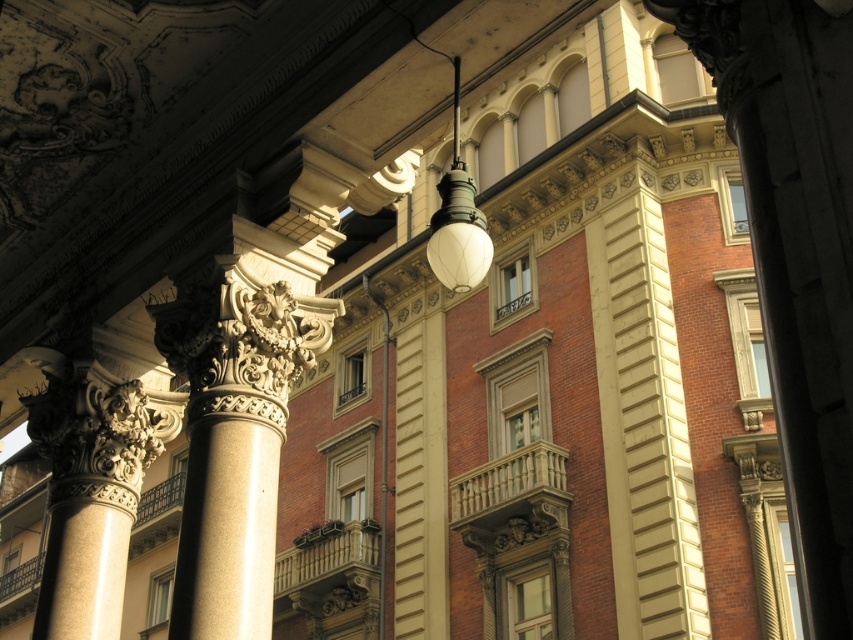
Question: Which point is closer to the camera?

Choices:
 (A) wooden balustrade at center
 (B) dark brown wrought iron at lower left

Answer: (B)

Question: Where is white glass lamp at center located in relation to white marble balustrade at center in the image?

Choices:
 (A) above
 (B) below

Answer: (A)

Question: Which object appears farthest from the camera in this image?

Choices:
 (A) white glass lamp at center
 (B) wooden balustrade at center
 (C) white marble balustrade at center
 (D) dark brown wrought iron at lower left

Answer: (B)

Question: Among these points, which one is nearest to the camera?

Choices:
 (A) (468, 193)
 (B) (154, 486)

Answer: (A)

Question: Does white marble balustrade at center have a greater width compared to dark brown wrought iron at lower left?

Choices:
 (A) no
 (B) yes

Answer: (A)

Question: Does white glass lamp at center appear on the right side of dark brown wrought iron at lower left?

Choices:
 (A) yes
 (B) no

Answer: (A)